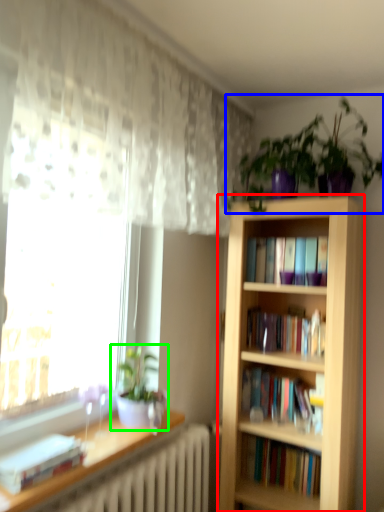
Question: Which is nearer to the bookcase (highlighted by a red box)? houseplant (highlighted by a blue box) or houseplant (highlighted by a green box).

Choices:
 (A) houseplant
 (B) houseplant

Answer: (A)